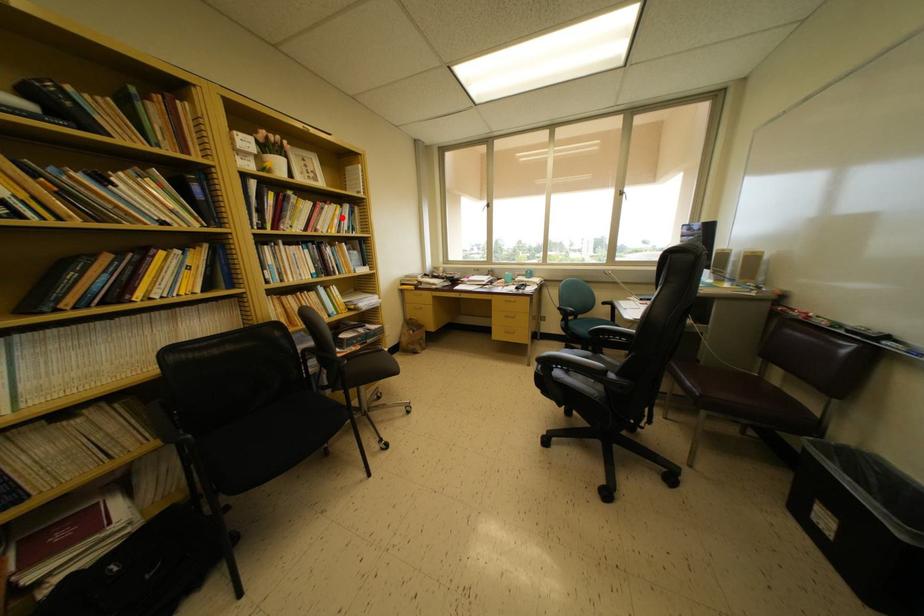
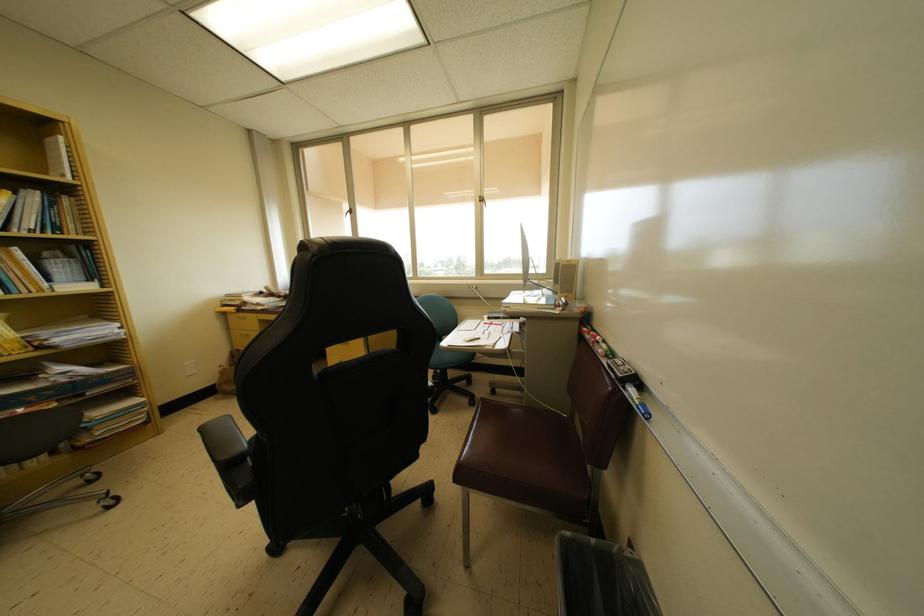
Locate, in the second image, the point that corresponds to the highlighted location in the first image.

(7, 206)